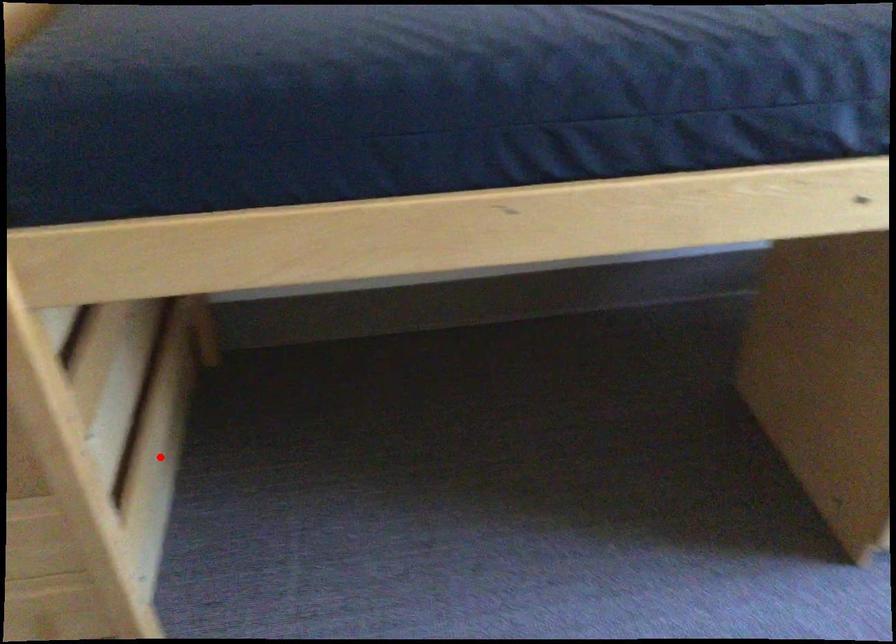
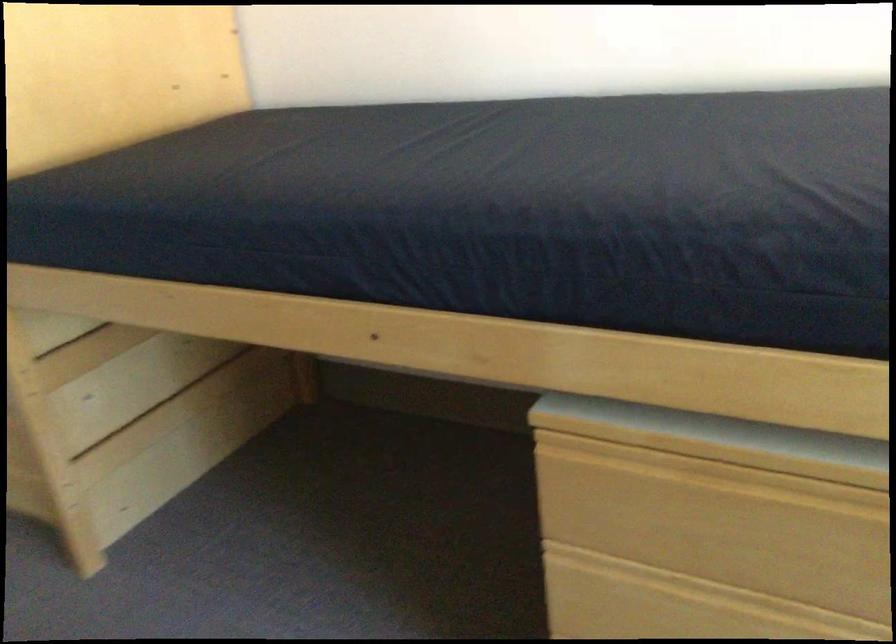
Question: I am providing you with two images of the same scene from different viewpoints. A red point is marked on the first image. At the location where the point appears in image 1, is it still visible in image 2?

Choices:
 (A) Yes
 (B) No

Answer: (A)